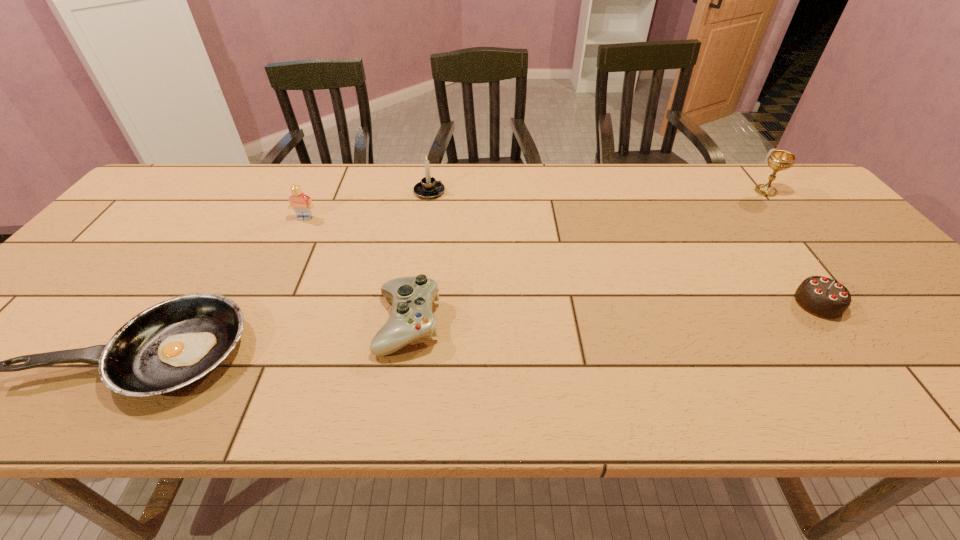
Find the location of a particular element. This screenshot has width=960, height=540. empty space between the candle holder and the control is located at coordinates (419, 257).

You are a GUI agent. You are given a task and a screenshot of the screen. Output one action in this format:
    pyautogui.click(x=<x>, y=<y>)
    Task: Click on the free space between the Lego and the candle holder
    The width and height of the screenshot is (960, 540).
    Given the screenshot: What is the action you would take?
    pyautogui.click(x=367, y=205)

This screenshot has height=540, width=960. Find the location of `vacant space that's between the chalice and the chocolate cake`. vacant space that's between the chalice and the chocolate cake is located at coordinates (792, 247).

You are a GUI agent. You are given a task and a screenshot of the screen. Output one action in this format:
    pyautogui.click(x=<x>, y=<y>)
    Task: Click on the vacant point located between the fifth object from left to right and the candle holder
    
    Given the screenshot: What is the action you would take?
    pyautogui.click(x=624, y=247)

Identify the location of free space between the control and the second object from right to left. This screenshot has width=960, height=540. (613, 313).

The height and width of the screenshot is (540, 960). I want to click on unoccupied area between the chocolate cake and the control, so click(x=613, y=313).

Identify the location of free spot between the candle holder and the Lego. (367, 205).

In order to click on free space between the control and the fourth nearest object in this screenshot , I will do `click(356, 271)`.

Select which object is the second closest to the control. Please provide its 2D coordinates. Your answer should be formatted as a tuple, i.e. [(x, y)], where the tuple contains the x and y coordinates of a point satisfying the conditions above.

[(301, 203)]

This screenshot has width=960, height=540. In order to click on object that is the closest to the chalice in this screenshot , I will do `click(823, 297)`.